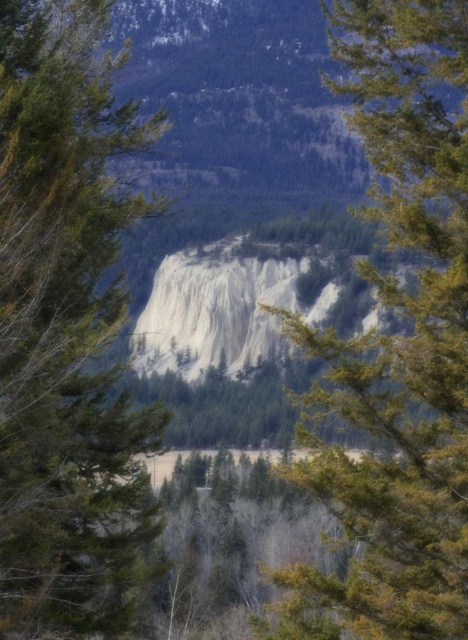
Who is lower down, green matte tree at center or green textured tree at center?

green textured tree at center is below.

Is green matte tree at center to the left of green textured tree at center from the viewer's perspective?

Indeed, green matte tree at center is positioned on the left side of green textured tree at center.

Is point (19, 24) closer to viewer compared to point (396, 16)?

No, (19, 24) is further to viewer.

The image size is (468, 640). Find the location of `green matte tree at center`. green matte tree at center is located at coordinates (65, 324).